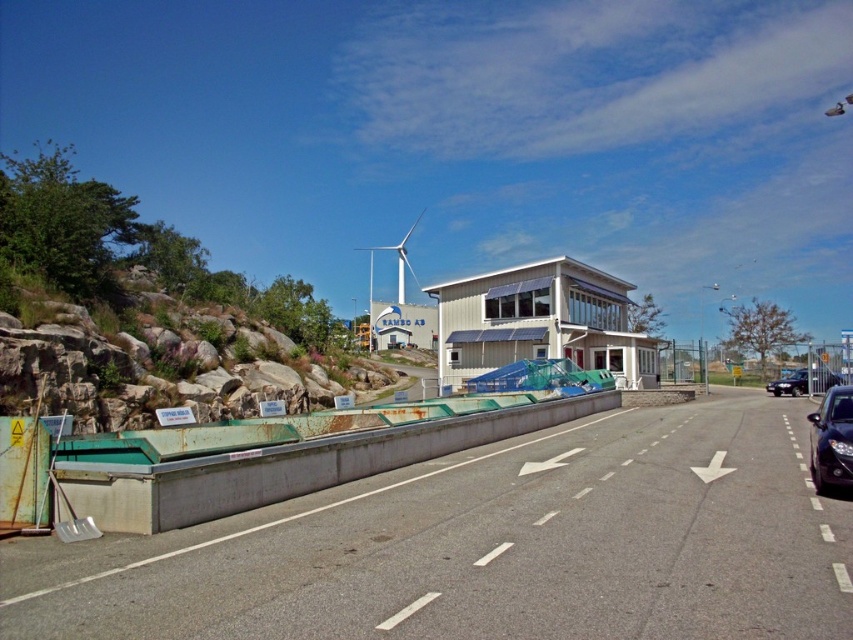
Question: Does rusty metal barrier at lower left have a greater width compared to dark blue metallic car at right?

Choices:
 (A) yes
 (B) no

Answer: (B)

Question: Considering the real-world distances, which object is closest to the rusty rock at left?

Choices:
 (A) dark blue metallic car at right
 (B) green concrete highway at lower left

Answer: (B)

Question: Which object is the closest to the rusty metal barrier at lower left?

Choices:
 (A) rusty rock at left
 (B) white matte wind turbine at center
 (C) black glossy car at right

Answer: (C)

Question: Which of the following is the closest to the observer?

Choices:
 (A) black glossy car at right
 (B) rusty metal barrier at lower left
 (C) white matte wind turbine at center

Answer: (B)

Question: From the image, what is the correct spatial relationship of rusty rock at left in relation to rusty metal barrier at lower left?

Choices:
 (A) above
 (B) below

Answer: (A)

Question: Is green concrete highway at lower left bigger than white matte wind turbine at center?

Choices:
 (A) no
 (B) yes

Answer: (A)